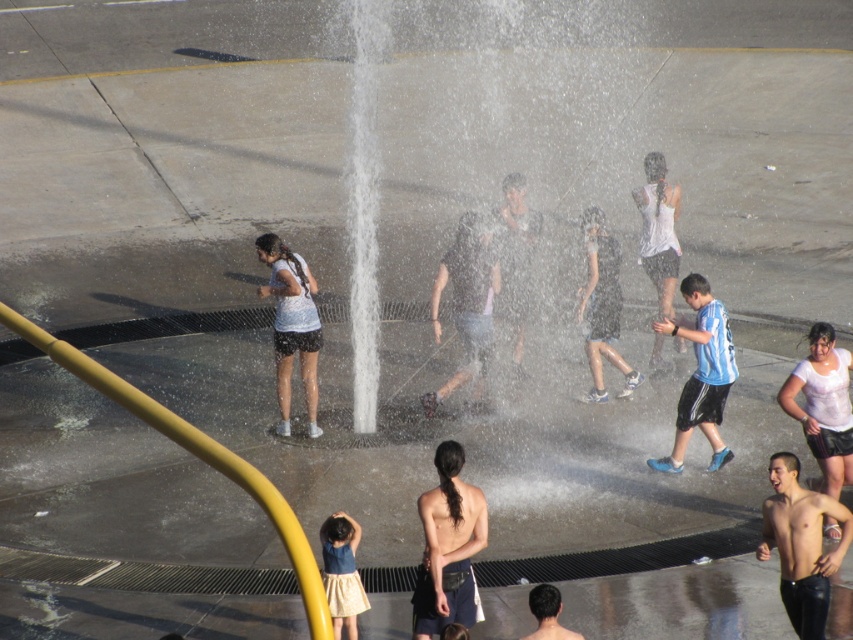
Find the location of a particular element. This screenshot has height=640, width=853. blue striped shirt at center is located at coordinates (701, 374).

Can you confirm if blue striped shirt at center is bigger than white matte shirt at center?

Indeed, blue striped shirt at center has a larger size compared to white matte shirt at center.

Who is more distant from viewer, (701, 282) or (838, 426)?

The point (701, 282) is more distant.

At what (x,y) coordinates should I click in order to perform the action: click on blue striped shirt at center. Please return your answer as a coordinate pair (x, y). Looking at the image, I should click on (701, 374).

Which of these two, white matte shirt at center or denim skirt at lower center, stands shorter?

denim skirt at lower center is shorter.

Who is more forward, (833, 419) or (325, 531)?

Point (325, 531) is in front.

What do you see at coordinates (822, 404) in the screenshot? I see `white matte shirt at center` at bounding box center [822, 404].

This screenshot has height=640, width=853. I want to click on white matte shirt at center, so click(x=822, y=404).

Who is shorter, dark gray fabric shirt at center or white matte tank top at center?

dark gray fabric shirt at center

Is point (437, 282) farther from camera compared to point (646, 216)?

No, it is not.

Locate an element on the screen. The width and height of the screenshot is (853, 640). dark gray fabric shirt at center is located at coordinates (466, 301).